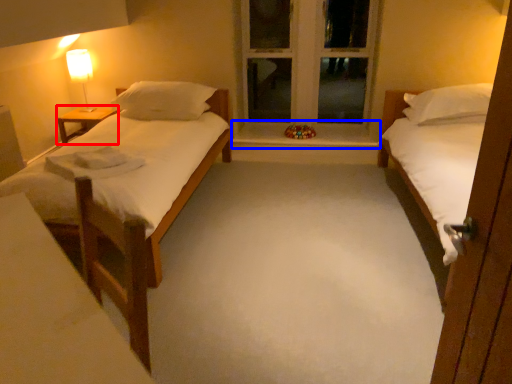
Question: Among these objects, which one is farthest to the camera, nightstand (highlighted by a red box) or window sill (highlighted by a blue box)?

Choices:
 (A) nightstand
 (B) window sill

Answer: (B)